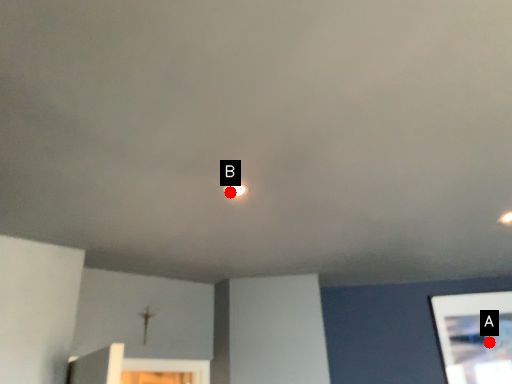
Question: Two points are circled on the image, labeled by A and B beside each circle. Which point is farther from the camera taking this photo?

Choices:
 (A) A is further
 (B) B is further

Answer: (A)